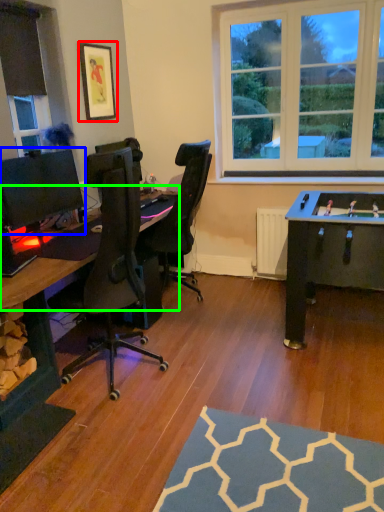
Question: Which object is the farthest from picture frame (highlighted by a red box)? Choose among these: computer monitor (highlighted by a blue box) or computer desk (highlighted by a green box).

Choices:
 (A) computer monitor
 (B) computer desk

Answer: (B)